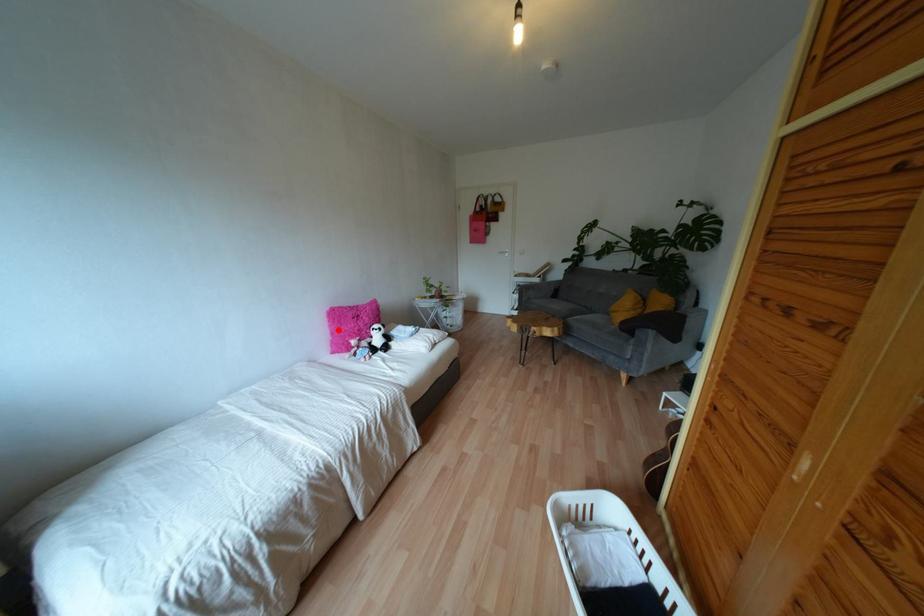
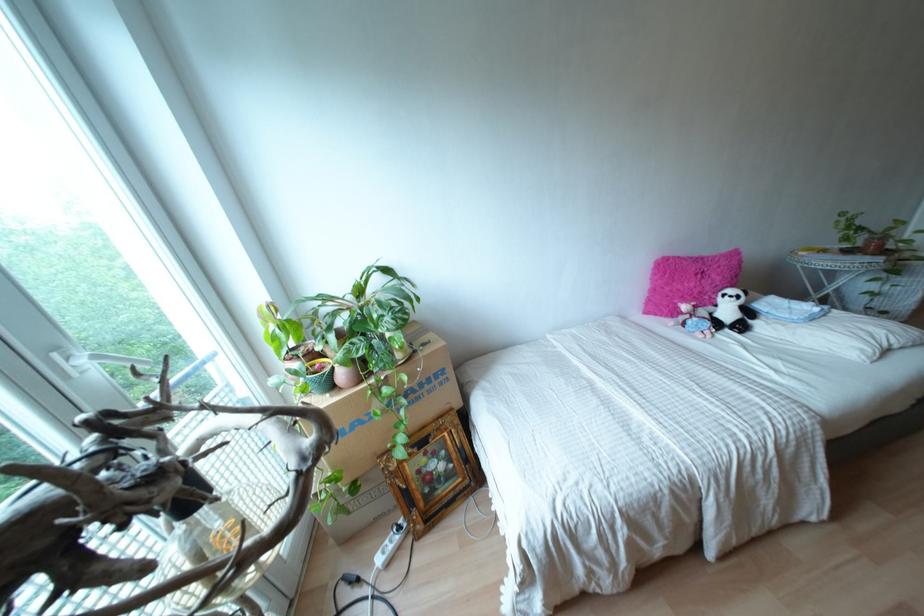
In the second image, find the point that corresponds to the highlighted location in the first image.

(666, 288)